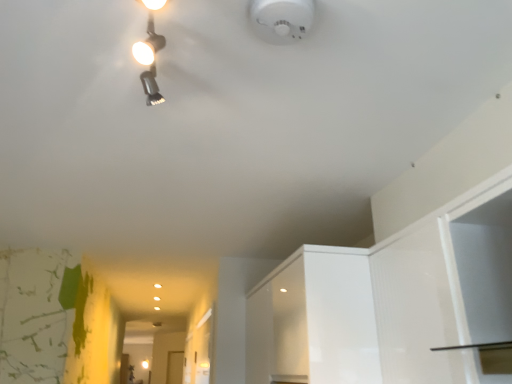
Identify the location of white plastic smoke detector at upper center. (281, 19).

What do you see at coordinates (281, 19) in the screenshot? I see `white plastic smoke detector at upper center` at bounding box center [281, 19].

The width and height of the screenshot is (512, 384). Find the location of `white plastic smoke detector at upper center`. white plastic smoke detector at upper center is located at coordinates (281, 19).